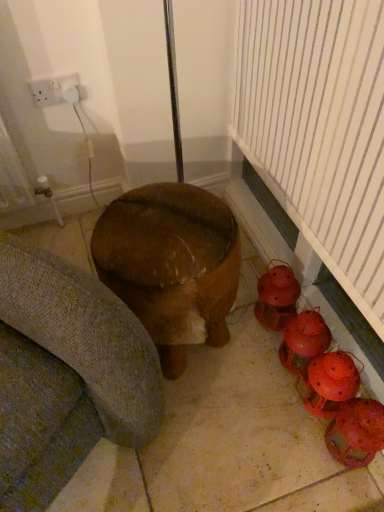
Question: Is wooden stool at center positioned in front of matte orange lanterns at lower right, arranged as the third toy when viewed from the top?

Choices:
 (A) no
 (B) yes

Answer: (B)

Question: Is wooden stool at center taller than matte orange lanterns at lower right, placed as the second toy when sorted from bottom to top?

Choices:
 (A) no
 (B) yes

Answer: (B)

Question: From a real-world perspective, is wooden stool at center positioned over matte orange lanterns at lower right, arranged as the third toy when viewed from the top, based on gravity?

Choices:
 (A) no
 (B) yes

Answer: (B)

Question: Is wooden stool at center wider than matte orange lanterns at lower right, arranged as the third toy when viewed from the top?

Choices:
 (A) yes
 (B) no

Answer: (A)

Question: Considering the relative positions of wooden stool at center and matte orange lanterns at lower right, arranged as the third toy when viewed from the top, in the image provided, is wooden stool at center to the left of matte orange lanterns at lower right, arranged as the third toy when viewed from the top, from the viewer's perspective?

Choices:
 (A) yes
 (B) no

Answer: (A)

Question: From the image's perspective, is wooden stool at center on matte orange lanterns at lower right, arranged as the third toy when viewed from the top?

Choices:
 (A) no
 (B) yes

Answer: (B)

Question: Is wooden stool at center closer to the viewer compared to matte red lantern at lower right, the 4th toy in the bottom-to-top sequence?

Choices:
 (A) yes
 (B) no

Answer: (A)

Question: From the image's perspective, is wooden stool at center located above matte red lantern at lower right, which ranks as the 1th toy in top-to-bottom order?

Choices:
 (A) no
 (B) yes

Answer: (B)

Question: Considering the relative sizes of wooden stool at center and matte red lantern at lower right, the 4th toy in the bottom-to-top sequence, in the image provided, is wooden stool at center thinner than matte red lantern at lower right, the 4th toy in the bottom-to-top sequence,?

Choices:
 (A) no
 (B) yes

Answer: (A)

Question: Does wooden stool at center have a smaller size compared to matte red lantern at lower right, the 4th toy in the bottom-to-top sequence?

Choices:
 (A) no
 (B) yes

Answer: (A)

Question: Considering the relative sizes of wooden stool at center and matte red lantern at lower right, which ranks as the 1th toy in top-to-bottom order, in the image provided, is wooden stool at center wider than matte red lantern at lower right, which ranks as the 1th toy in top-to-bottom order,?

Choices:
 (A) no
 (B) yes

Answer: (B)

Question: Can you confirm if wooden stool at center is shorter than matte red lantern at lower right, which ranks as the 1th toy in top-to-bottom order?

Choices:
 (A) yes
 (B) no

Answer: (B)

Question: From a real-world perspective, does matte red lantern at lower right, acting as the 1th toy starting from the bottom, stand above white plastic socket at upper left?

Choices:
 (A) no
 (B) yes

Answer: (A)